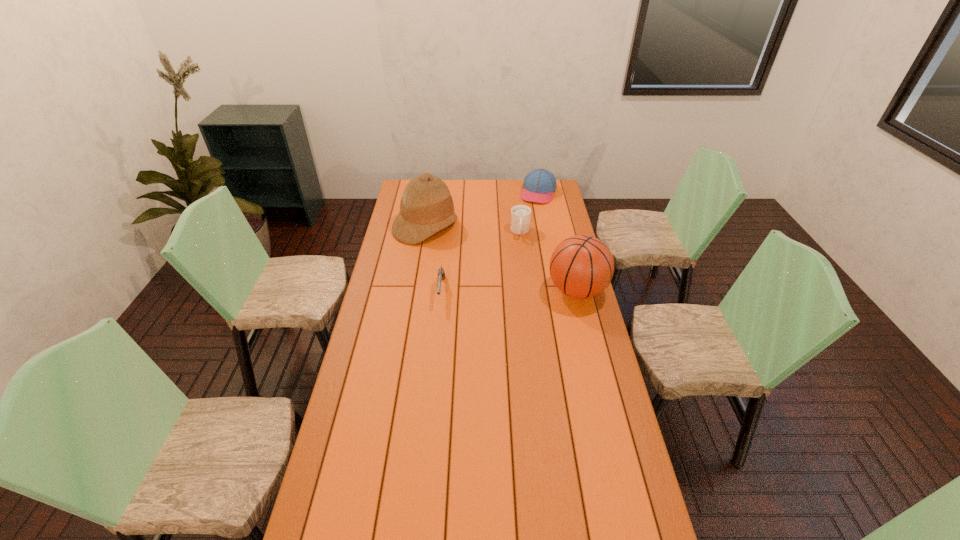
Find the location of a particular element. gun is located at coordinates [x=441, y=274].

In order to click on basketball in this screenshot , I will do (582, 266).

Where is `cappuccino`? This screenshot has height=540, width=960. cappuccino is located at coordinates (520, 214).

Identify the location of hat. The image size is (960, 540). (426, 207).

Where is `the farthest object`? This screenshot has width=960, height=540. the farthest object is located at coordinates (539, 185).

Identify the location of vacant area situated aiming along the barrel of the gun. (432, 392).

The height and width of the screenshot is (540, 960). In order to click on vacant area located on the front of the basketball in this screenshot , I will do `click(585, 321)`.

I want to click on vacant space located on the side with the handle of the cappuccino, so click(519, 295).

You are a GUI agent. You are given a task and a screenshot of the screen. Output one action in this format:
    pyautogui.click(x=<x>, y=<y>)
    Task: Click on the vacant area located 0.160m on the side with the handle of the cappuccino
    This screenshot has width=960, height=540.
    Given the screenshot: What is the action you would take?
    pyautogui.click(x=520, y=261)

Identify the location of vacant space located 0.090m on the side with the handle of the cappuccino. (520, 252).